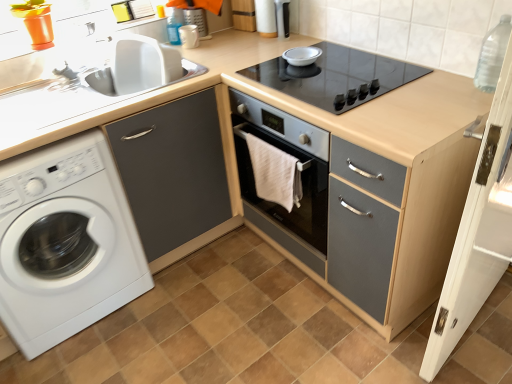
Image resolution: width=512 pixels, height=384 pixels. I want to click on free space to the right of metallic silver toaster at upper center, which is the 2th appliance from left to right, so click(311, 41).